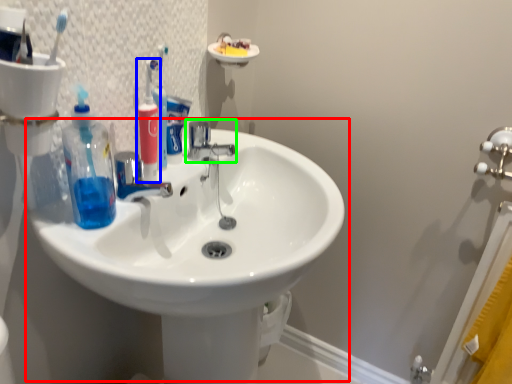
Question: Considering the real-world distances, which object is closest to sink (highlighted by a red box)? toiletry (highlighted by a blue box) or tap (highlighted by a green box).

Choices:
 (A) toiletry
 (B) tap

Answer: (B)